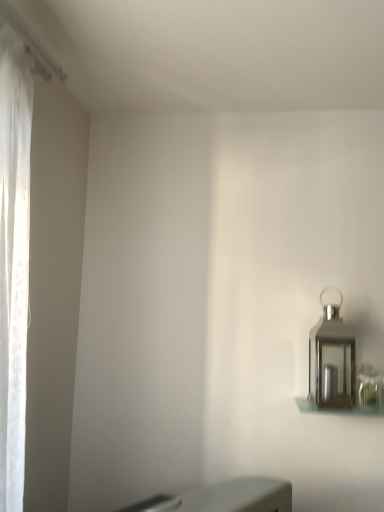
The height and width of the screenshot is (512, 384). What do you see at coordinates (332, 359) in the screenshot? I see `polished silver lantern at right` at bounding box center [332, 359].

In order to face polished silver lantern at right, should I rotate leftwards or rightwards?

Rotate right and turn 18.222 degrees.

Image resolution: width=384 pixels, height=512 pixels. I want to click on polished silver lantern at right, so click(x=332, y=359).

Where is `polished silver lantern at right`? The height and width of the screenshot is (512, 384). polished silver lantern at right is located at coordinates (332, 359).